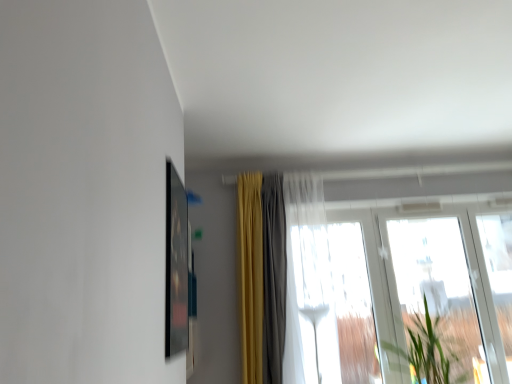
Question: Which direction should I rotate to face velvet yellow curtain at center, which is the first curtain in left-to-right order, — up or down?

Choices:
 (A) down
 (B) up

Answer: (A)

Question: Are green leafy plant at right and velvet yellow curtain at center, which is the first curtain in left-to-right order, far apart?

Choices:
 (A) no
 (B) yes

Answer: (B)

Question: Does green leafy plant at right appear on the left side of velvet yellow curtain at center, the second curtain from the right?

Choices:
 (A) yes
 (B) no

Answer: (B)

Question: Is green leafy plant at right located outside velvet yellow curtain at center, the second curtain from the right?

Choices:
 (A) yes
 (B) no

Answer: (A)

Question: Considering the relative sizes of green leafy plant at right and velvet yellow curtain at center, the second curtain from the right, in the image provided, is green leafy plant at right shorter than velvet yellow curtain at center, the second curtain from the right,?

Choices:
 (A) no
 (B) yes

Answer: (B)

Question: Is green leafy plant at right bigger than velvet yellow curtain at center, the second curtain from the right?

Choices:
 (A) no
 (B) yes

Answer: (B)

Question: From a real-world perspective, is green leafy plant at right on velvet yellow curtain at center, the second curtain from the right?

Choices:
 (A) yes
 (B) no

Answer: (B)

Question: Can you confirm if green leafy plant at right is wider than transparent glass window at right, which is the third window from left to right?

Choices:
 (A) yes
 (B) no

Answer: (A)

Question: Would you consider green leafy plant at right to be distant from transparent glass window at right, which appears as the first window when viewed from the right?

Choices:
 (A) no
 (B) yes

Answer: (A)

Question: Is green leafy plant at right taller than transparent glass window at right, which appears as the first window when viewed from the right?

Choices:
 (A) yes
 (B) no

Answer: (B)

Question: From the image's perspective, would you say green leafy plant at right is shown under transparent glass window at right, which appears as the first window when viewed from the right?

Choices:
 (A) yes
 (B) no

Answer: (A)

Question: Is transparent glass window at right, which appears as the first window when viewed from the right, completely or partially inside green leafy plant at right?

Choices:
 (A) yes
 (B) no

Answer: (B)

Question: Is green leafy plant at right smaller than transparent glass window at right, which appears as the first window when viewed from the right?

Choices:
 (A) yes
 (B) no

Answer: (B)

Question: From a real-world perspective, is matte black picture frame at upper left beneath transparent glass window at right, which appears as the first window when viewed from the right?

Choices:
 (A) no
 (B) yes

Answer: (A)